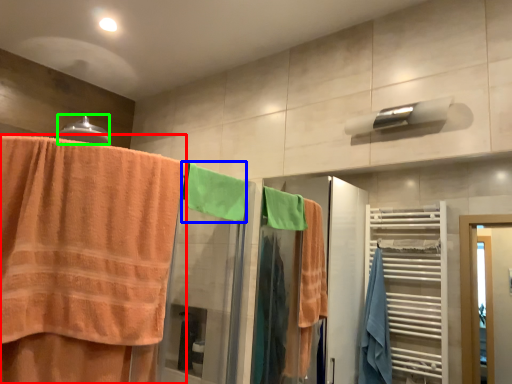
Question: Which object is positioned closest to towel (highlighted by a red box)? Select from beach towel (highlighted by a blue box) and towel bar (highlighted by a green box).

Choices:
 (A) beach towel
 (B) towel bar

Answer: (A)